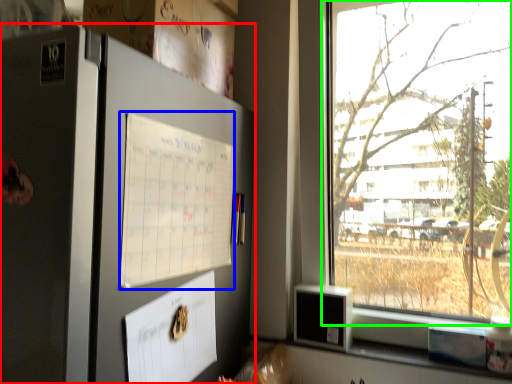
Question: Estimate the real-world distances between objects in this image. Which object is farther from fridge (highlighted by a red box), poster (highlighted by a blue box) or window (highlighted by a green box)?

Choices:
 (A) poster
 (B) window

Answer: (B)